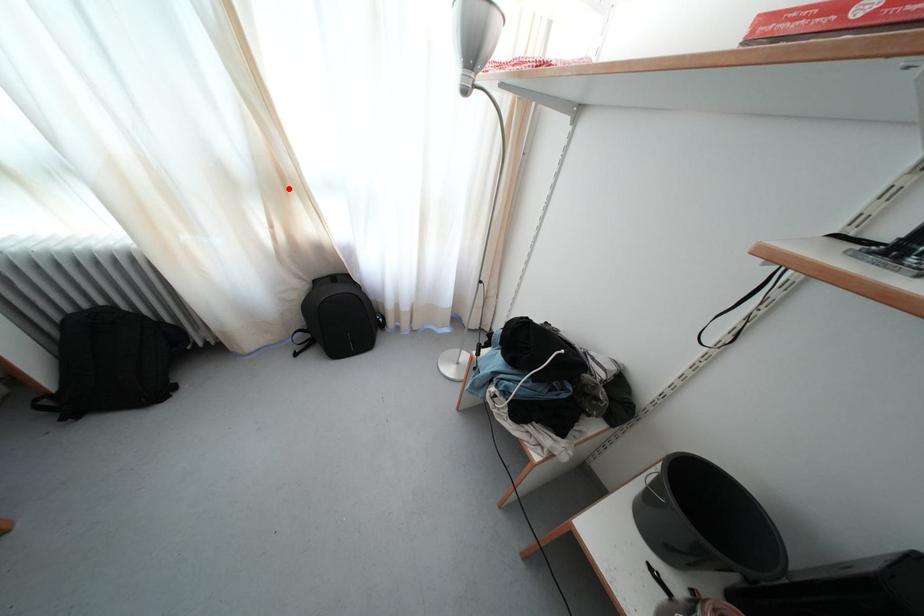
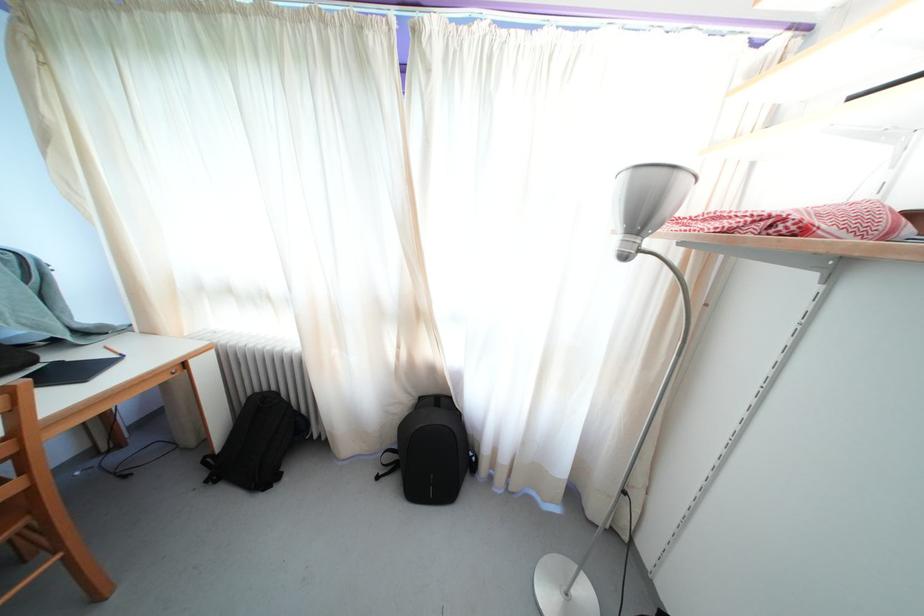
Where in the second image is the point corresponding to the highlighted location from the first image?

(421, 321)